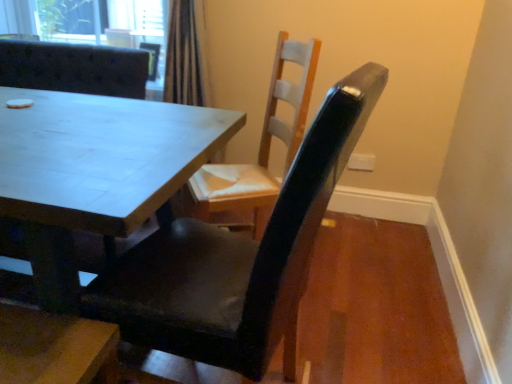
Question: From the image's perspective, would you say white wood chair at center, which ranks as the 1th chair in right-to-left order, is positioned over matte black chair at center, which is counted as the second chair, starting from the right?

Choices:
 (A) no
 (B) yes

Answer: (B)

Question: Is white wood chair at center, which ranks as the 1th chair in right-to-left order, oriented towards matte black chair at center, the 2th chair when ordered from left to right?

Choices:
 (A) yes
 (B) no

Answer: (B)

Question: Is white wood chair at center, which ranks as the 1th chair in right-to-left order, shorter than matte black chair at center, the 2th chair when ordered from left to right?

Choices:
 (A) yes
 (B) no

Answer: (A)

Question: Does white wood chair at center, which appears as the third chair when viewed from the left, have a lesser width compared to matte black chair at center, the 2th chair when ordered from left to right?

Choices:
 (A) yes
 (B) no

Answer: (A)

Question: Is white wood chair at center, which ranks as the 1th chair in right-to-left order, completely or partially outside of matte black chair at center, the 2th chair when ordered from left to right?

Choices:
 (A) no
 (B) yes

Answer: (B)

Question: Considering their positions, is matte black chair at center, positioned as the third chair in right-to-left order, located in front of or behind white wood chair at center, which ranks as the 1th chair in right-to-left order?

Choices:
 (A) front
 (B) behind

Answer: (B)

Question: Looking at the image, does matte black chair at center, marked as the first chair in a left-to-right arrangement, seem bigger or smaller compared to white wood chair at center, which appears as the third chair when viewed from the left?

Choices:
 (A) big
 (B) small

Answer: (A)

Question: From a real-world perspective, is matte black chair at center, marked as the first chair in a left-to-right arrangement, physically located above or below white wood chair at center, which appears as the third chair when viewed from the left?

Choices:
 (A) below
 (B) above

Answer: (A)

Question: Is matte black chair at center, positioned as the third chair in right-to-left order, situated inside white wood chair at center, which appears as the third chair when viewed from the left, or outside?

Choices:
 (A) outside
 (B) inside

Answer: (A)

Question: Is matte black chair at center, which is counted as the second chair, starting from the right, bigger or smaller than matte black chair at center, positioned as the third chair in right-to-left order?

Choices:
 (A) small
 (B) big

Answer: (A)

Question: From the image's perspective, is matte black chair at center, which is counted as the second chair, starting from the right, positioned above or below matte black chair at center, positioned as the third chair in right-to-left order?

Choices:
 (A) above
 (B) below

Answer: (B)

Question: Is matte black chair at center, which is counted as the second chair, starting from the right, inside or outside of matte black chair at center, marked as the first chair in a left-to-right arrangement?

Choices:
 (A) inside
 (B) outside

Answer: (B)

Question: Considering the positions of matte black chair at center, which is counted as the second chair, starting from the right, and matte black chair at center, positioned as the third chair in right-to-left order, in the image, is matte black chair at center, which is counted as the second chair, starting from the right, wider or thinner than matte black chair at center, positioned as the third chair in right-to-left order,?

Choices:
 (A) thin
 (B) wide

Answer: (A)

Question: From the image's perspective, is matte black chair at center, the 2th chair when ordered from left to right, above or below white wood chair at center, which appears as the third chair when viewed from the left?

Choices:
 (A) below
 (B) above

Answer: (A)

Question: Is matte black chair at center, the 2th chair when ordered from left to right, inside the boundaries of white wood chair at center, which appears as the third chair when viewed from the left, or outside?

Choices:
 (A) outside
 (B) inside

Answer: (A)